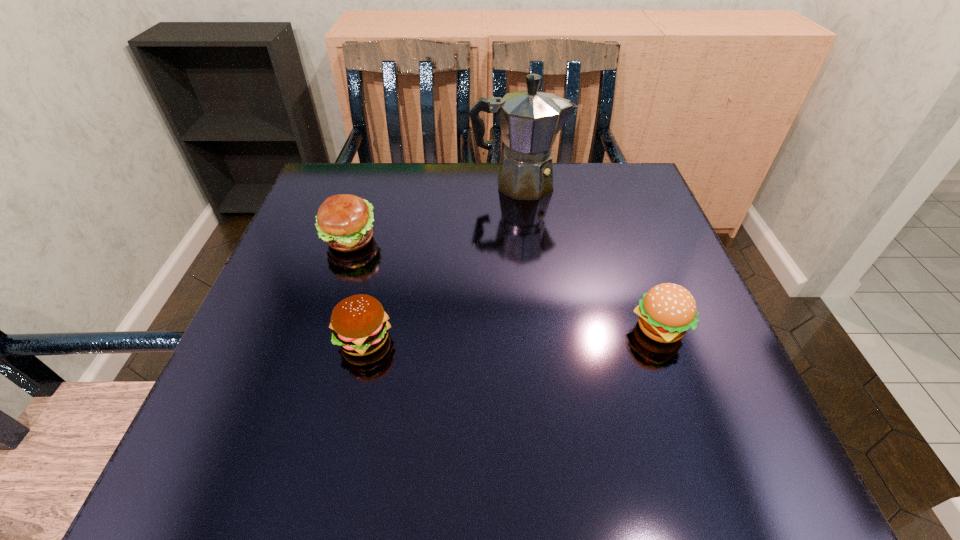
Find the location of `free space at the near edge`. free space at the near edge is located at coordinates (540, 429).

This screenshot has width=960, height=540. In order to click on vacant space at the left edge of the desktop in this screenshot , I will do `click(286, 386)`.

Identify the location of free space at the right edge of the desktop. The height and width of the screenshot is (540, 960). (720, 390).

The width and height of the screenshot is (960, 540). Identify the location of free location at the far left corner of the desktop. (320, 200).

Where is `free space at the near left corner of the desktop`? free space at the near left corner of the desktop is located at coordinates (200, 474).

Locate an element on the screen. blank area at the far right corner is located at coordinates (617, 170).

In the image, there is a desktop. Where is `vacant area at the near right corner`? vacant area at the near right corner is located at coordinates (729, 457).

This screenshot has height=540, width=960. Find the location of `vacant space in between the rightmost object and the tallest object`. vacant space in between the rightmost object and the tallest object is located at coordinates (588, 256).

Find the location of `vacant region between the farthest hamburger and the rightmost object`. vacant region between the farthest hamburger and the rightmost object is located at coordinates 504,284.

Identify the location of free space between the coffeepot and the third nearest object. (434, 212).